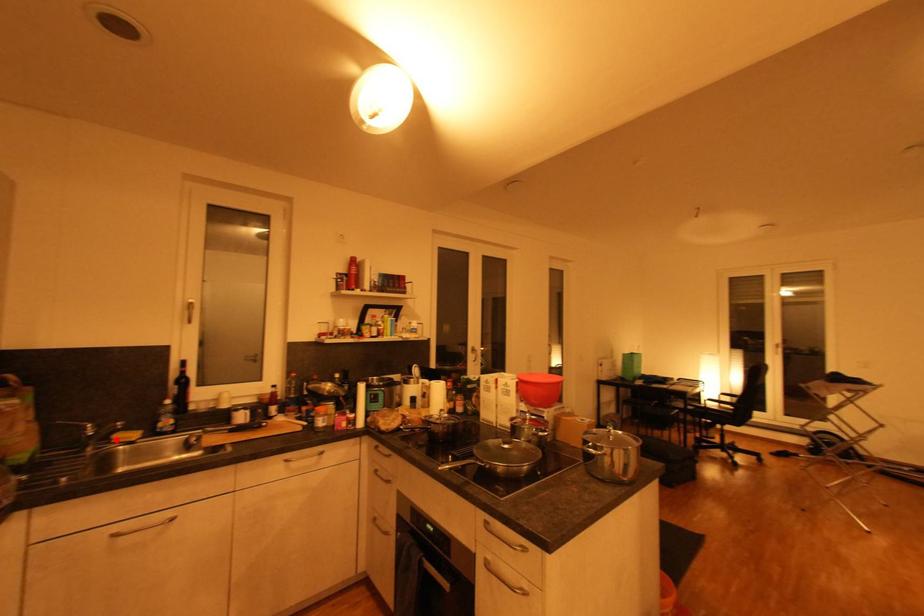
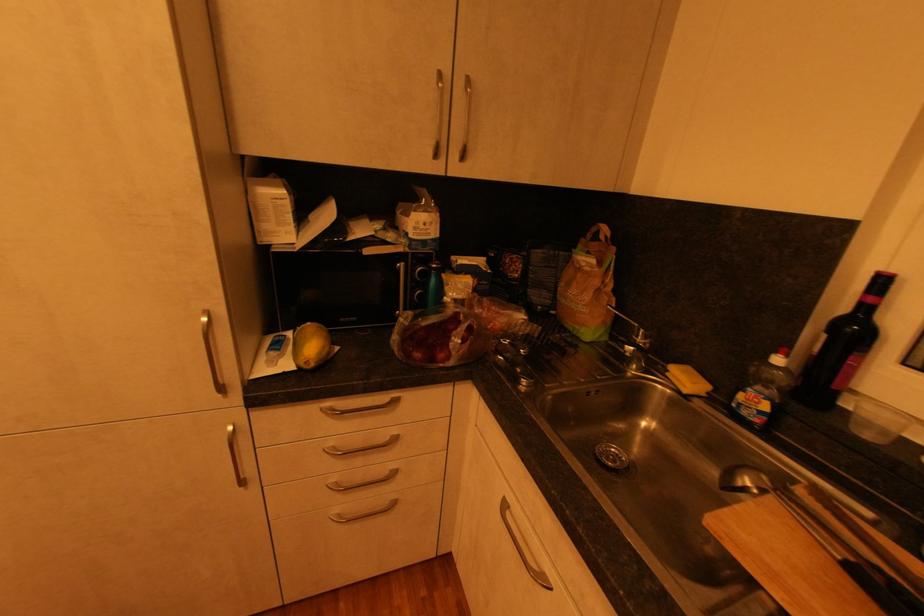
Where in the second image is the point corresponding to the highlighted location from the first image?

(672, 371)